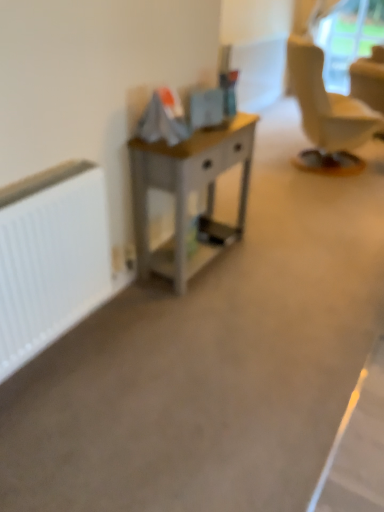
Question: Does transparent plastic window screen at upper right have a lesser height compared to white matte radiator at left?

Choices:
 (A) yes
 (B) no

Answer: (B)

Question: Is transparent plastic window screen at upper right smaller than white matte radiator at left?

Choices:
 (A) yes
 (B) no

Answer: (B)

Question: From a real-world perspective, is transparent plastic window screen at upper right on top of white matte radiator at left?

Choices:
 (A) no
 (B) yes

Answer: (B)

Question: From the image's perspective, is transparent plastic window screen at upper right located beneath white matte radiator at left?

Choices:
 (A) no
 (B) yes

Answer: (A)

Question: From the image's perspective, is transparent plastic window screen at upper right on white matte radiator at left?

Choices:
 (A) no
 (B) yes

Answer: (B)

Question: Considering the relative sizes of transparent plastic window screen at upper right and white matte radiator at left in the image provided, is transparent plastic window screen at upper right thinner than white matte radiator at left?

Choices:
 (A) no
 (B) yes

Answer: (B)

Question: Is wooden desk at center facing away from transparent plastic window screen at upper right?

Choices:
 (A) yes
 (B) no

Answer: (B)

Question: Is wooden desk at center oriented towards transparent plastic window screen at upper right?

Choices:
 (A) no
 (B) yes

Answer: (A)

Question: From the image's perspective, is wooden desk at center above transparent plastic window screen at upper right?

Choices:
 (A) yes
 (B) no

Answer: (B)

Question: Does wooden desk at center have a lesser height compared to transparent plastic window screen at upper right?

Choices:
 (A) no
 (B) yes

Answer: (B)

Question: Considering the relative sizes of wooden desk at center and transparent plastic window screen at upper right in the image provided, is wooden desk at center taller than transparent plastic window screen at upper right?

Choices:
 (A) no
 (B) yes

Answer: (A)

Question: Is transparent plastic window screen at upper right completely or partially inside wooden desk at center?

Choices:
 (A) yes
 (B) no

Answer: (B)

Question: Considering the relative sizes of white matte radiator at left and wooden desk at center in the image provided, is white matte radiator at left thinner than wooden desk at center?

Choices:
 (A) yes
 (B) no

Answer: (A)